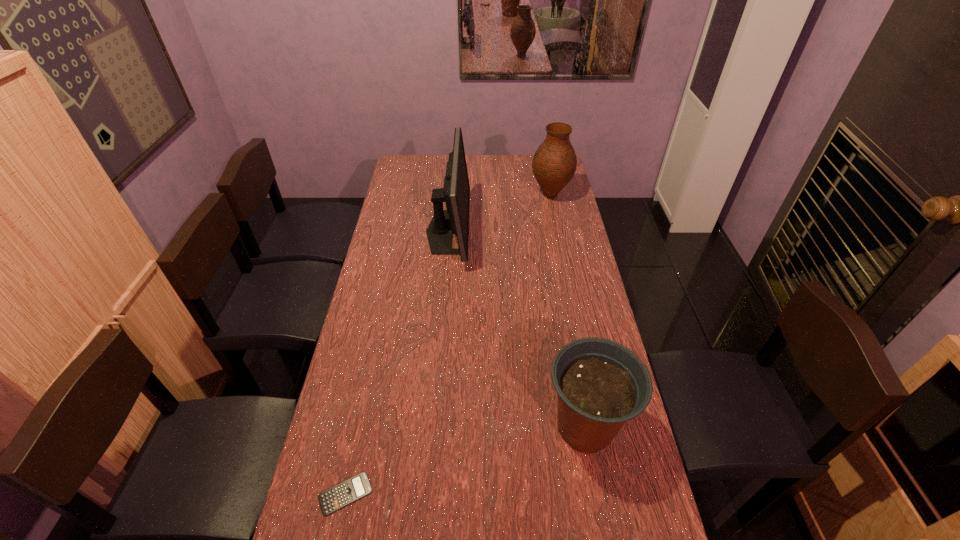
The width and height of the screenshot is (960, 540). In order to click on unoccupied position between the third farthest object and the vase in this screenshot , I will do `click(567, 310)`.

Where is `object that ranks as the closest to the flowerpot`? The image size is (960, 540). object that ranks as the closest to the flowerpot is located at coordinates (354, 488).

Select which object appears as the second closest to the vase. Please provide its 2D coordinates. Your answer should be formatted as a tuple, i.e. [(x, y)], where the tuple contains the x and y coordinates of a point satisfying the conditions above.

[(601, 384)]

Identify the location of free space that satisfies the following two spatial constraints: 1. on the front side of the vase; 2. on the screen side of the second object from left to right. (558, 232).

In order to click on vacant space that satisfies the following two spatial constraints: 1. on the front side of the vase; 2. on the screen side of the computer monitor in this screenshot , I will do `click(558, 232)`.